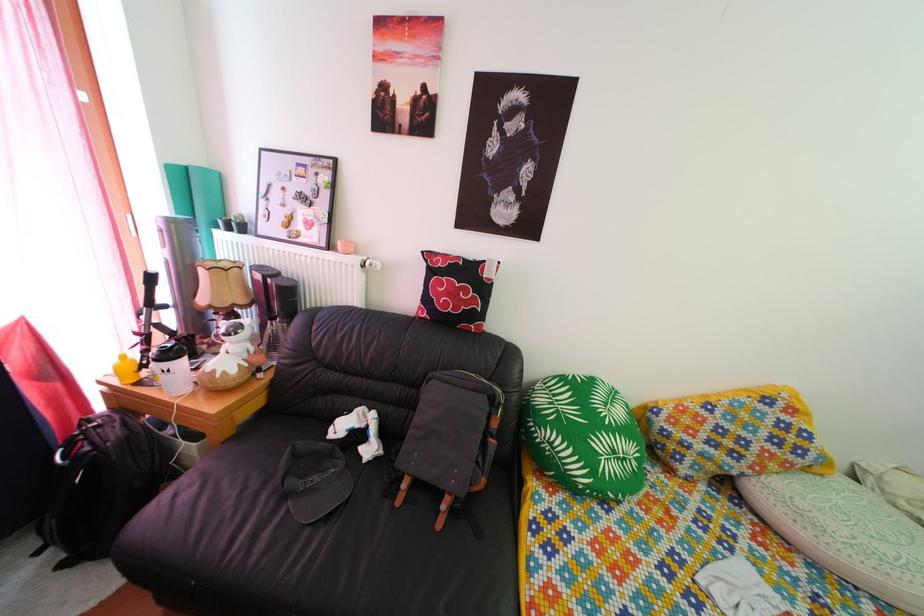
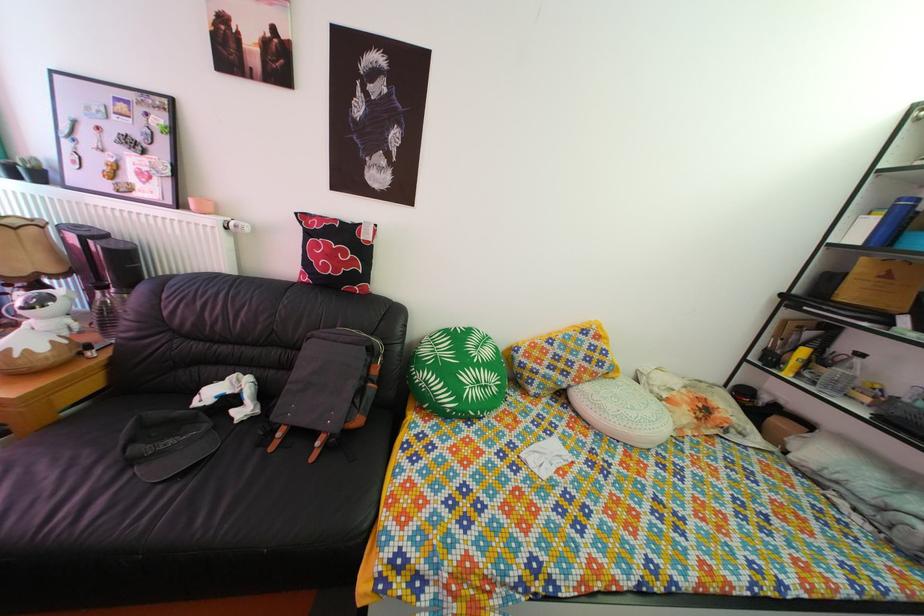
Find the pixel in the second image that matches point (634, 468) in the first image.

(494, 395)